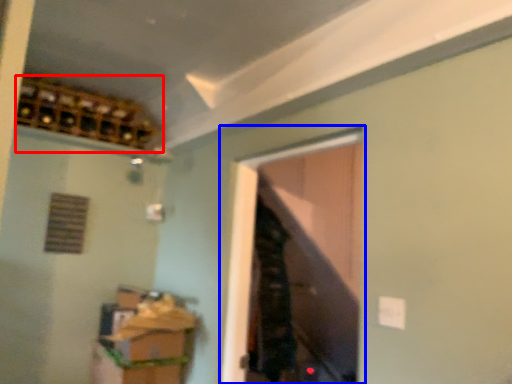
Question: Among these objects, which one is farthest to the camera, wine cabinet (highlighted by a red box) or window (highlighted by a blue box)?

Choices:
 (A) wine cabinet
 (B) window

Answer: (A)